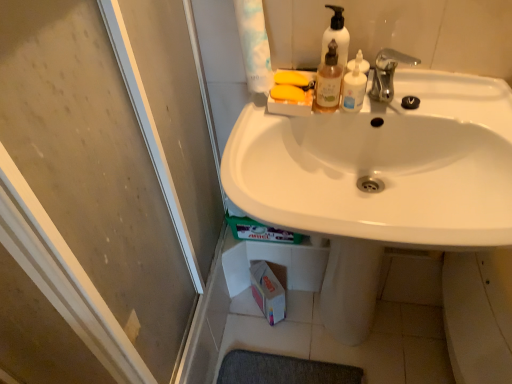
Question: Is translucent plastic pump bottle at upper center oriented away from white glossy toilet paper at upper center?

Choices:
 (A) yes
 (B) no

Answer: (B)

Question: From the image's perspective, is translucent plastic pump bottle at upper center over white glossy toilet paper at upper center?

Choices:
 (A) yes
 (B) no

Answer: (B)

Question: Can we say translucent plastic pump bottle at upper center lies outside white glossy toilet paper at upper center?

Choices:
 (A) no
 (B) yes

Answer: (B)

Question: Can you confirm if translucent plastic pump bottle at upper center is bigger than white glossy toilet paper at upper center?

Choices:
 (A) yes
 (B) no

Answer: (B)

Question: Can you confirm if translucent plastic pump bottle at upper center is shorter than white glossy toilet paper at upper center?

Choices:
 (A) no
 (B) yes

Answer: (B)

Question: Can you confirm if translucent plastic pump bottle at upper center is positioned to the left of white glossy toilet paper at upper center?

Choices:
 (A) no
 (B) yes

Answer: (A)

Question: From the image's perspective, is white plastic mouthwash at upper center, which is the 2th mouthwash from left to right, under translucent plastic pump bottle at upper center?

Choices:
 (A) no
 (B) yes

Answer: (B)

Question: Is white plastic mouthwash at upper center, positioned as the first mouthwash in right-to-left order, to the left of translucent plastic pump bottle at upper center from the viewer's perspective?

Choices:
 (A) no
 (B) yes

Answer: (A)

Question: From the image's perspective, is white plastic mouthwash at upper center, which is the 2th mouthwash from left to right, on top of translucent plastic pump bottle at upper center?

Choices:
 (A) no
 (B) yes

Answer: (A)

Question: Can translucent plastic pump bottle at upper center be found inside white plastic mouthwash at upper center, positioned as the first mouthwash in right-to-left order?

Choices:
 (A) yes
 (B) no

Answer: (B)

Question: Can you confirm if white plastic mouthwash at upper center, positioned as the first mouthwash in right-to-left order, is shorter than translucent plastic pump bottle at upper center?

Choices:
 (A) no
 (B) yes

Answer: (B)

Question: Considering the relative sizes of white plastic mouthwash at upper center, which is the 2th mouthwash from left to right, and translucent plastic pump bottle at upper center in the image provided, is white plastic mouthwash at upper center, which is the 2th mouthwash from left to right, wider than translucent plastic pump bottle at upper center?

Choices:
 (A) no
 (B) yes

Answer: (A)

Question: Considering the relative sizes of translucent plastic pump bottle at upper center and white glossy sink at center in the image provided, is translucent plastic pump bottle at upper center taller than white glossy sink at center?

Choices:
 (A) no
 (B) yes

Answer: (A)